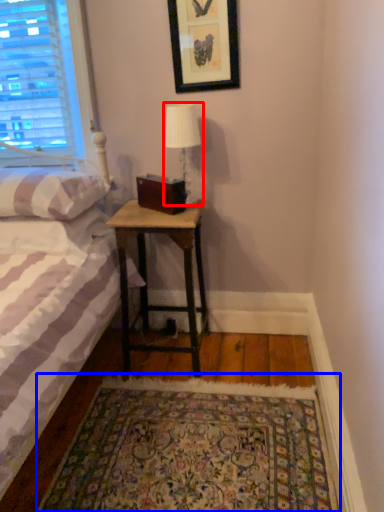
Question: Which object appears closest to the camera in this image, table lamp (highlighted by a red box) or mat (highlighted by a blue box)?

Choices:
 (A) table lamp
 (B) mat

Answer: (B)